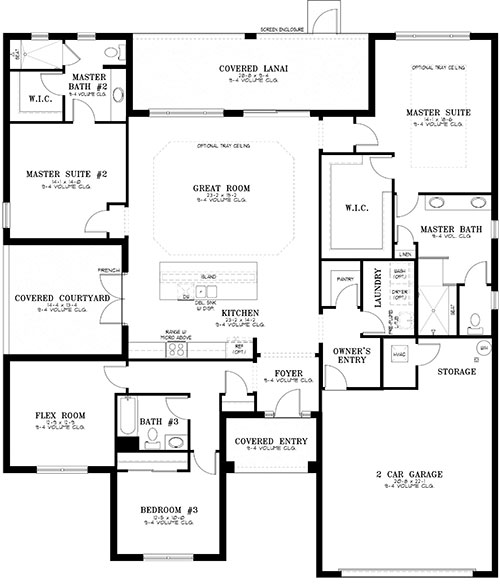
Locate an element on the screen. This screenshot has width=500, height=584. living quarters is located at coordinates (430, 147), (64, 172), (50, 406), (153, 497).